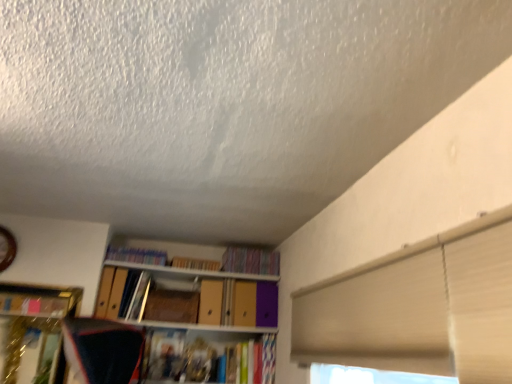
Question: Is multicolored fabric book at upper center, marked as the third book in a left-to-right arrangement, spatially inside matte cardboard book at upper center, positioned as the 2th book in left-to-right order, or outside of it?

Choices:
 (A) outside
 (B) inside

Answer: (A)

Question: From their relative heights in the image, would you say multicolored fabric book at upper center, marked as the third book in a left-to-right arrangement, is taller or shorter than matte cardboard book at upper center, positioned as the 2th book in left-to-right order?

Choices:
 (A) tall
 (B) short

Answer: (A)

Question: Which is farther from the wooden paperback book at center?

Choices:
 (A) multicolored fabric book at upper center, marked as the 1th book in a right-to-left arrangement
 (B) matte cardboard book at upper center, positioned as the 2th book in left-to-right order
 (C) matte plastic books at upper center, arranged as the 3th book when viewed from the right

Answer: (A)

Question: Which object is the closest to the wooden paperback book at center?

Choices:
 (A) multicolored fabric book at upper center, marked as the third book in a left-to-right arrangement
 (B) matte plastic books at upper center, arranged as the 3th book when viewed from the right
 (C) matte cardboard book at upper center, arranged as the 2th book when viewed from the right

Answer: (C)